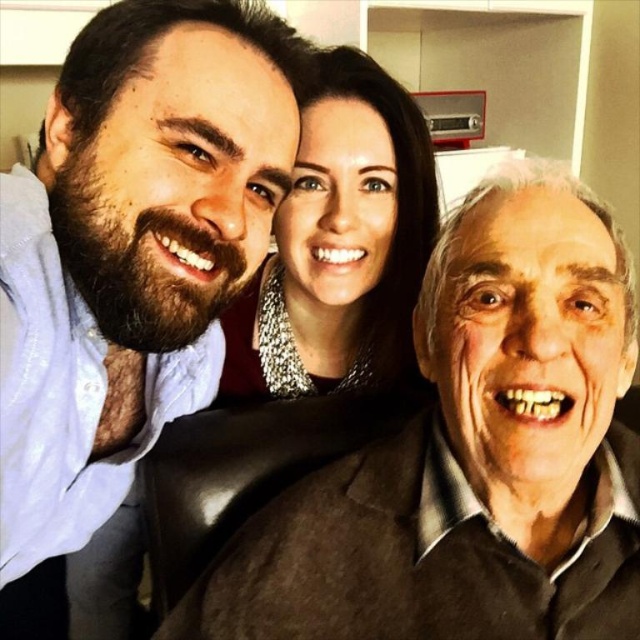
You are trying to take a photo of the matte blue shirt at left and the silver metallic necklace at upper center. Which object is wider?

The matte blue shirt at left is wider than the silver metallic necklace at upper center.

You are a photographer who wants to take a closeup shot of the matte black jacket at center. The camera you are using has a minimum focusing distance of 20 inches. Can you take the closeup without moving either the camera or the jacket?

The matte black jacket at center and camera are 21.70 inches apart. Since the minimum focusing distance is 20 inches, the camera can focus on the matte black jacket at center from this distance.